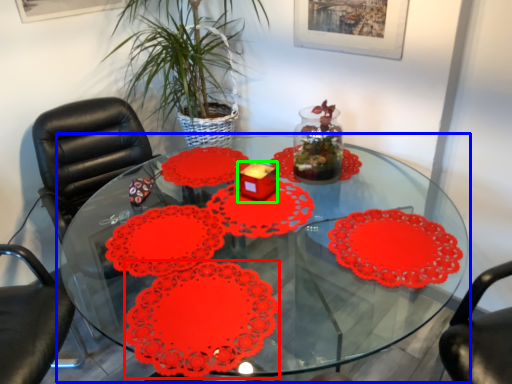
Question: Considering the real-world distances, which object is closest to flower (highlighted by a red box)? table (highlighted by a blue box) or candle holder (highlighted by a green box).

Choices:
 (A) table
 (B) candle holder

Answer: (B)